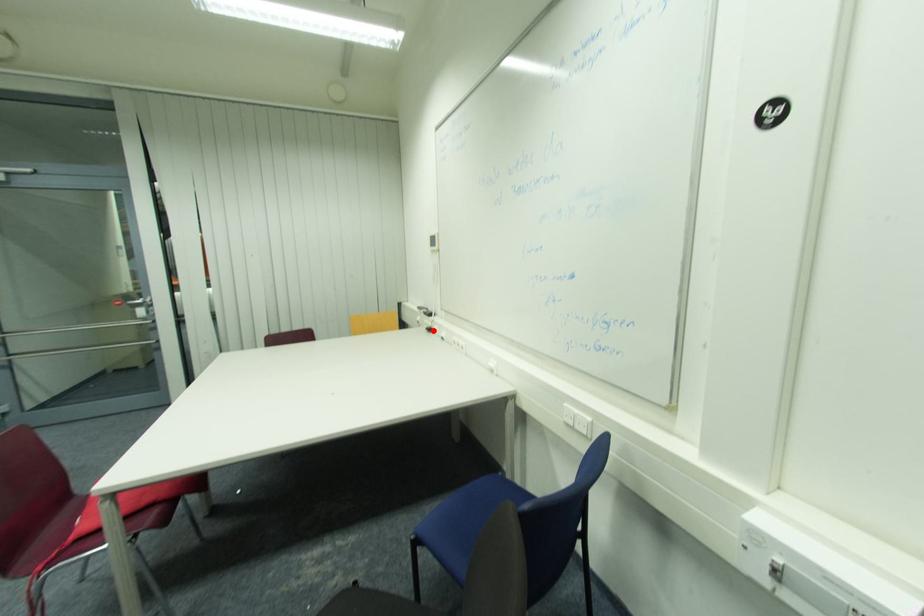
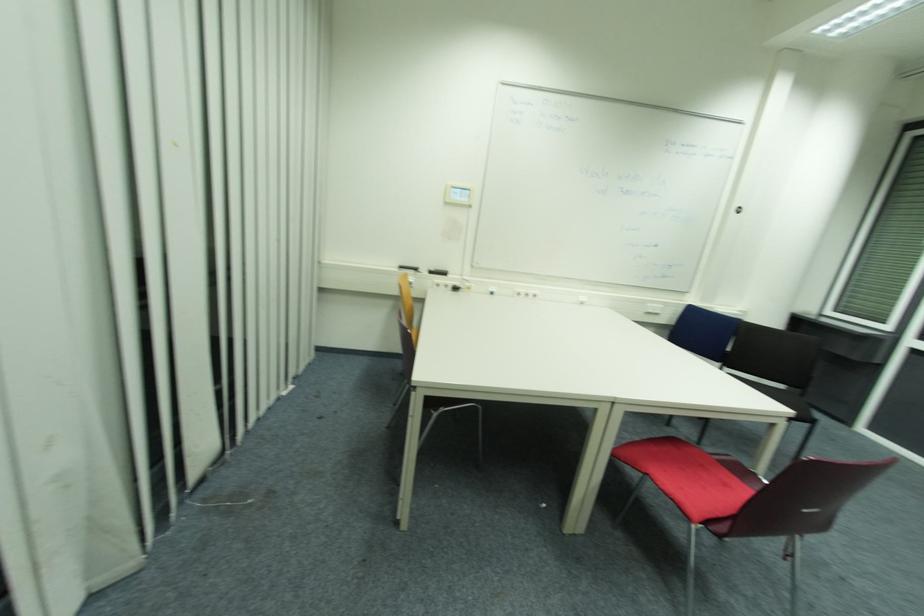
The point at the highlighted location is marked in the first image. Where is the corresponding point in the second image?

(458, 290)